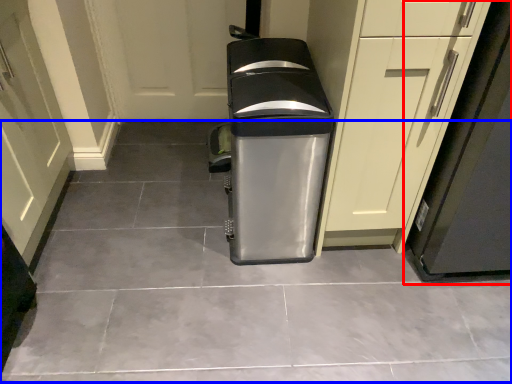
Question: Which object appears farthest to the camera in this image, appliance (highlighted by a red box) or concrete (highlighted by a blue box)?

Choices:
 (A) appliance
 (B) concrete

Answer: (B)